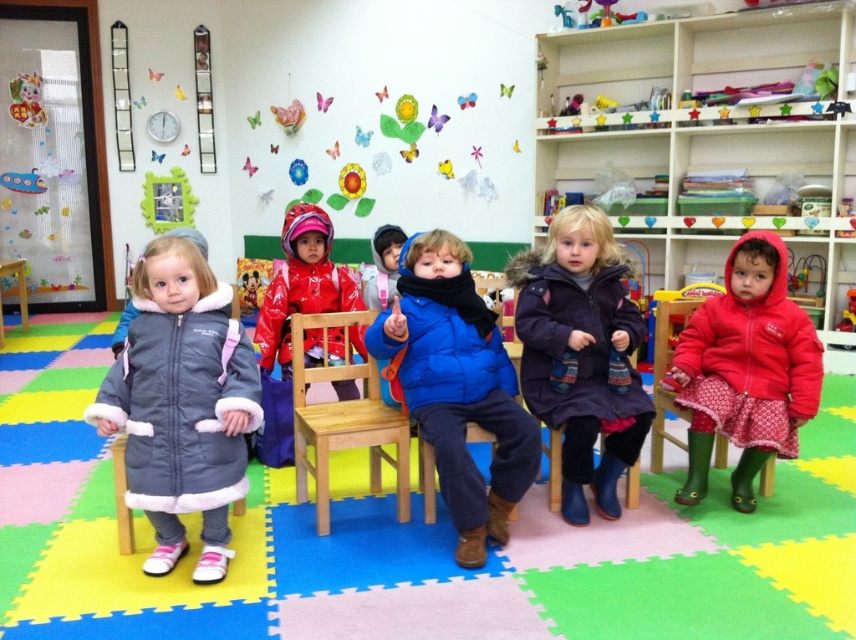
Question: Does light brown wooden chair at center lie in front of blue fleece jacket at center?

Choices:
 (A) no
 (B) yes

Answer: (B)

Question: Which object appears closest to the camera in this image?

Choices:
 (A) blue fuzzy coat at center
 (B) wooden chair at center

Answer: (A)

Question: Which object is closer to the camera taking this photo?

Choices:
 (A) gray fleece coat at left
 (B) light brown wooden chair at center

Answer: (A)

Question: Is blue fuzzy coat at center positioned before rubber duck at upper right?

Choices:
 (A) no
 (B) yes

Answer: (B)

Question: Can you confirm if purple fuzzy coat at center is positioned above blue fleece jacket at center?

Choices:
 (A) yes
 (B) no

Answer: (B)

Question: Which object is closer to the camera taking this photo?

Choices:
 (A) purple fuzzy coat at center
 (B) light brown wooden chair at center
 (C) red matte jacket at right
 (D) metallic photo frame at upper left

Answer: (B)